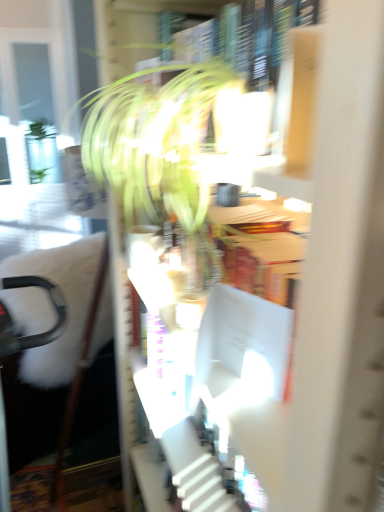
What do you see at coordinates (334, 289) in the screenshot? I see `white cardboard bookcase at center` at bounding box center [334, 289].

The width and height of the screenshot is (384, 512). I want to click on green leafy plant at center, so click(x=158, y=150).

In the scene shown: Is white cardboard bookcase at center oriented towards black plastic swivel chair at left?

No.

Where is `swivel chair below the white cardboard bookcase at center (from the image's perspective)`? This screenshot has height=512, width=384. swivel chair below the white cardboard bookcase at center (from the image's perspective) is located at coordinates (57, 387).

From a real-world perspective, who is located lower, white cardboard bookcase at center or black plastic swivel chair at left?

black plastic swivel chair at left, from a real-world perspective.

Is the position of white cardboard bookcase at center more distant than that of black plastic swivel chair at left?

No.

In the scene shown: Is white cardboard bookcase at center at the back of black plastic swivel chair at left?

That's not correct — black plastic swivel chair at left is not looking away from white cardboard bookcase at center.

Is black plastic swivel chair at left situated inside white cardboard bookcase at center or outside?

black plastic swivel chair at left is spatially situated outside white cardboard bookcase at center.

Between black plastic swivel chair at left and white cardboard bookcase at center, which one has smaller size?

white cardboard bookcase at center is smaller.

From a real-world perspective, between black plastic swivel chair at left and white cardboard bookcase at center, who is vertically lower?

black plastic swivel chair at left is physically lower.

Can you confirm if green leafy plant at center is thinner than black plastic swivel chair at left?

Yes, green leafy plant at center is thinner than black plastic swivel chair at left.

From their relative heights in the image, would you say green leafy plant at center is taller or shorter than black plastic swivel chair at left?

Clearly, green leafy plant at center is shorter compared to black plastic swivel chair at left.

From the picture: Which object is positioned more to the left, green leafy plant at center or black plastic swivel chair at left?

Positioned to the left is black plastic swivel chair at left.

Based on the photo, is white cardboard bookcase at center positioned far away from green leafy plant at center?

No, there isn't a large distance between white cardboard bookcase at center and green leafy plant at center.

Is white cardboard bookcase at center positioned in front of green leafy plant at center?

That is True.

In terms of height, does white cardboard bookcase at center look taller or shorter compared to green leafy plant at center?

Clearly, white cardboard bookcase at center is shorter compared to green leafy plant at center.

Can we say white cardboard bookcase at center lies outside green leafy plant at center?

Yes, white cardboard bookcase at center is outside of green leafy plant at center.

From the image's perspective, is black plastic swivel chair at left on top of green leafy plant at center?

No, from the image's perspective, black plastic swivel chair at left is not over green leafy plant at center.

Does black plastic swivel chair at left touch green leafy plant at center?

No.

From a real-world perspective, who is located higher, black plastic swivel chair at left or green leafy plant at center?

green leafy plant at center.

Would you say green leafy plant at center is part of black plastic swivel chair at left's contents?

Definitely not — green leafy plant at center is not inside black plastic swivel chair at left.

Would you say green leafy plant at center is a long distance from white cardboard bookcase at center?

No, green leafy plant at center is not far away from white cardboard bookcase at center.

From a real-world perspective, who is located higher, green leafy plant at center or white cardboard bookcase at center?

green leafy plant at center is physically above.

Considering the positions of objects green leafy plant at center and white cardboard bookcase at center in the image provided, who is in front, green leafy plant at center or white cardboard bookcase at center?

white cardboard bookcase at center is in front.

Locate an element on the screen. swivel chair behind the white cardboard bookcase at center is located at coordinates (57, 387).

The height and width of the screenshot is (512, 384). In order to click on swivel chair that is below the white cardboard bookcase at center (from the image's perspective) in this screenshot , I will do `click(57, 387)`.

Based on their spatial positions, is green leafy plant at center or white cardboard bookcase at center closer to black plastic swivel chair at left?

green leafy plant at center is closer to black plastic swivel chair at left.

Looking at the image, which one is located further to white cardboard bookcase at center, black plastic swivel chair at left or green leafy plant at center?

black plastic swivel chair at left.

Estimate the real-world distances between objects in this image. Which object is further from green leafy plant at center, black plastic swivel chair at left or white cardboard bookcase at center?

Among the two, black plastic swivel chair at left is located further to green leafy plant at center.

From the image, which object appears to be nearer to green leafy plant at center, white cardboard bookcase at center or black plastic swivel chair at left?

white cardboard bookcase at center is closer to green leafy plant at center.

Which object lies further to the anchor point white cardboard bookcase at center, green leafy plant at center or black plastic swivel chair at left?

The object further to white cardboard bookcase at center is black plastic swivel chair at left.

From the image, which object appears to be farther from black plastic swivel chair at left, white cardboard bookcase at center or green leafy plant at center?

Based on the image, white cardboard bookcase at center appears to be further to black plastic swivel chair at left.

You are a GUI agent. You are given a task and a screenshot of the screen. Output one action in this format:
    pyautogui.click(x=<x>, y=<y>)
    Task: Click on the bookcase between green leafy plant at center and black plastic swivel chair at left in the up-down direction
    This screenshot has height=512, width=384.
    Given the screenshot: What is the action you would take?
    pyautogui.click(x=334, y=289)